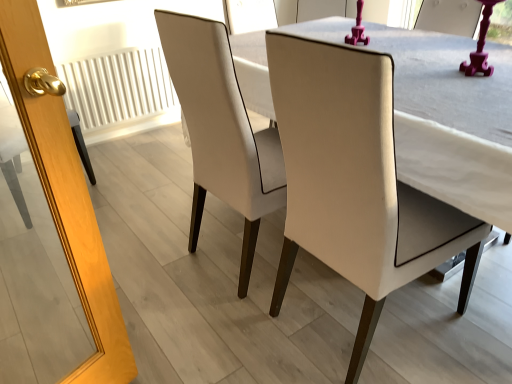
The image size is (512, 384). In order to click on white leather chair at center, arranged as the first chair when viewed from the left in this screenshot , I will do `click(221, 130)`.

Where is `white leather chair at center, which is the 2th chair in right-to-left order`? The image size is (512, 384). white leather chair at center, which is the 2th chair in right-to-left order is located at coordinates (221, 130).

Can you see white leather chair at center, arranged as the first chair when viewed from the left, touching matte white chair at center, which is counted as the 2th chair, starting from the left?

No, white leather chair at center, arranged as the first chair when viewed from the left, is not beside matte white chair at center, which is counted as the 2th chair, starting from the left.

From a real-world perspective, who is located lower, white leather chair at center, which is the 2th chair in right-to-left order, or matte white chair at center, the 1th chair in the right-to-left sequence?

matte white chair at center, the 1th chair in the right-to-left sequence, from a real-world perspective.

Looking at this image, how different are the orientations of white leather chair at center, arranged as the first chair when viewed from the left, and matte white chair at center, the 1th chair in the right-to-left sequence, in degrees?

The angular difference between white leather chair at center, arranged as the first chair when viewed from the left, and matte white chair at center, the 1th chair in the right-to-left sequence, is 179 degrees.

Considering the relative sizes of white leather chair at center, which is the 2th chair in right-to-left order, and matte white chair at center, the 1th chair in the right-to-left sequence, in the image provided, is white leather chair at center, which is the 2th chair in right-to-left order, shorter than matte white chair at center, the 1th chair in the right-to-left sequence,?

No.

Does white leather chair at center, arranged as the first chair when viewed from the left, appear on the left side of white textured radiator at left?

In fact, white leather chair at center, arranged as the first chair when viewed from the left, is to the right of white textured radiator at left.

Is white leather chair at center, arranged as the first chair when viewed from the left, touching white textured radiator at left?

white leather chair at center, arranged as the first chair when viewed from the left, is not next to white textured radiator at left, and they're not touching.

Is white leather chair at center, arranged as the first chair when viewed from the left, facing away from white textured radiator at left?

No, white leather chair at center, arranged as the first chair when viewed from the left, is not facing away from white textured radiator at left.

How much distance is there between white leather chair at center, arranged as the first chair when viewed from the left, and white textured radiator at left?

They are 1.49 meters apart.

Is there a large distance between white textured radiator at left and white leather chair at center, which is the 2th chair in right-to-left order?

Yes, white textured radiator at left and white leather chair at center, which is the 2th chair in right-to-left order, are located far from each other.

Which point is more distant from viewer, (x=93, y=127) or (x=193, y=243)?

The point (x=93, y=127) is behind.

Based on their sizes in the image, would you say white textured radiator at left is bigger or smaller than white leather chair at center, arranged as the first chair when viewed from the left?

In the image, white textured radiator at left appears to be smaller than white leather chair at center, arranged as the first chair when viewed from the left.

Is white textured radiator at left positioned with its back to white leather chair at center, which is the 2th chair in right-to-left order?

No, white textured radiator at left is not facing the opposite direction of white leather chair at center, which is the 2th chair in right-to-left order.

From the image's perspective, does matte white chair at center, the 1th chair in the right-to-left sequence, appear higher than white textured radiator at left?

Actually, matte white chair at center, the 1th chair in the right-to-left sequence, appears below white textured radiator at left in the image.

Where is `radiator that appears below the matte white chair at center, which is counted as the 2th chair, starting from the left (from a real-world perspective)`? The width and height of the screenshot is (512, 384). radiator that appears below the matte white chair at center, which is counted as the 2th chair, starting from the left (from a real-world perspective) is located at coordinates (118, 88).

Is matte white chair at center, which is counted as the 2th chair, starting from the left, to the left of white textured radiator at left from the viewer's perspective?

No, matte white chair at center, which is counted as the 2th chair, starting from the left, is not to the left of white textured radiator at left.

Does matte white chair at center, which is counted as the 2th chair, starting from the left, have a greater height compared to white textured radiator at left?

Yes.

Is white textured radiator at left placed right next to matte white chair at center, the 1th chair in the right-to-left sequence?

white textured radiator at left and matte white chair at center, the 1th chair in the right-to-left sequence, are not in contact.

Is white textured radiator at left completely or partially outside of matte white chair at center, the 1th chair in the right-to-left sequence?

Yes, white textured radiator at left is not within matte white chair at center, the 1th chair in the right-to-left sequence.

Which is more distant, (125, 78) or (323, 211)?

The point (125, 78) is behind.

Can you confirm if white textured radiator at left is wider than matte white chair at center, the 1th chair in the right-to-left sequence?

No.

Is matte white chair at center, the 1th chair in the right-to-left sequence, not near white leather chair at center, arranged as the first chair when viewed from the left?

No, matte white chair at center, the 1th chair in the right-to-left sequence, is not far away from white leather chair at center, arranged as the first chair when viewed from the left.

What's the angular difference between matte white chair at center, which is counted as the 2th chair, starting from the left, and white leather chair at center, arranged as the first chair when viewed from the left,'s facing directions?

There is a 179-degree angle between the facing directions of matte white chair at center, which is counted as the 2th chair, starting from the left, and white leather chair at center, arranged as the first chair when viewed from the left.

Is matte white chair at center, the 1th chair in the right-to-left sequence, oriented away from white leather chair at center, arranged as the first chair when viewed from the left?

matte white chair at center, the 1th chair in the right-to-left sequence, is not turned away from white leather chair at center, arranged as the first chair when viewed from the left.

Can you confirm if matte white chair at center, which is counted as the 2th chair, starting from the left, is smaller than white leather chair at center, which is the 2th chair in right-to-left order?

No.

Find the location of a particular element. chair located above the white leather chair at center, arranged as the first chair when viewed from the left (from the image's perspective) is located at coordinates (315, 168).

There is a white textured radiator at left. Where is `the 2nd chair above it (from a real-world perspective)`? This screenshot has height=384, width=512. the 2nd chair above it (from a real-world perspective) is located at coordinates (221, 130).

When comparing their distances from white leather chair at center, which is the 2th chair in right-to-left order, does matte white chair at center, the 1th chair in the right-to-left sequence, or white textured radiator at left seem further?

white textured radiator at left is positioned further to the anchor white leather chair at center, which is the 2th chair in right-to-left order.

When comparing their distances from white textured radiator at left, does matte white chair at center, which is counted as the 2th chair, starting from the left, or white leather chair at center, arranged as the first chair when viewed from the left, seem further?

matte white chair at center, which is counted as the 2th chair, starting from the left, lies further to white textured radiator at left than the other object.

Based on their spatial positions, is white leather chair at center, which is the 2th chair in right-to-left order, or white textured radiator at left closer to matte white chair at center, which is counted as the 2th chair, starting from the left?

white leather chair at center, which is the 2th chair in right-to-left order, is positioned closer to the anchor matte white chair at center, which is counted as the 2th chair, starting from the left.

Looking at the image, which one is located closer to matte white chair at center, the 1th chair in the right-to-left sequence, white textured radiator at left or white leather chair at center, arranged as the first chair when viewed from the left?

white leather chair at center, arranged as the first chair when viewed from the left.

Based on their spatial positions, is white textured radiator at left or matte white chair at center, the 1th chair in the right-to-left sequence, closer to white leather chair at center, which is the 2th chair in right-to-left order?

matte white chair at center, the 1th chair in the right-to-left sequence, is closer to white leather chair at center, which is the 2th chair in right-to-left order.

When comparing their distances from white textured radiator at left, does white leather chair at center, which is the 2th chair in right-to-left order, or matte white chair at center, which is counted as the 2th chair, starting from the left, seem further?

The object further to white textured radiator at left is matte white chair at center, which is counted as the 2th chair, starting from the left.

Locate an element on the screen. The height and width of the screenshot is (384, 512). chair located between matte white chair at center, the 1th chair in the right-to-left sequence, and white textured radiator at left in the depth direction is located at coordinates (221, 130).